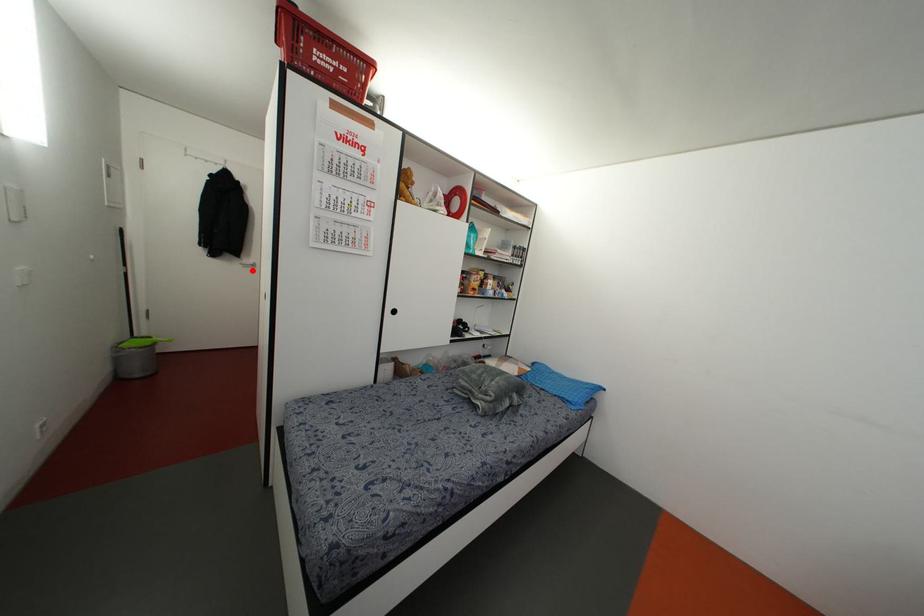
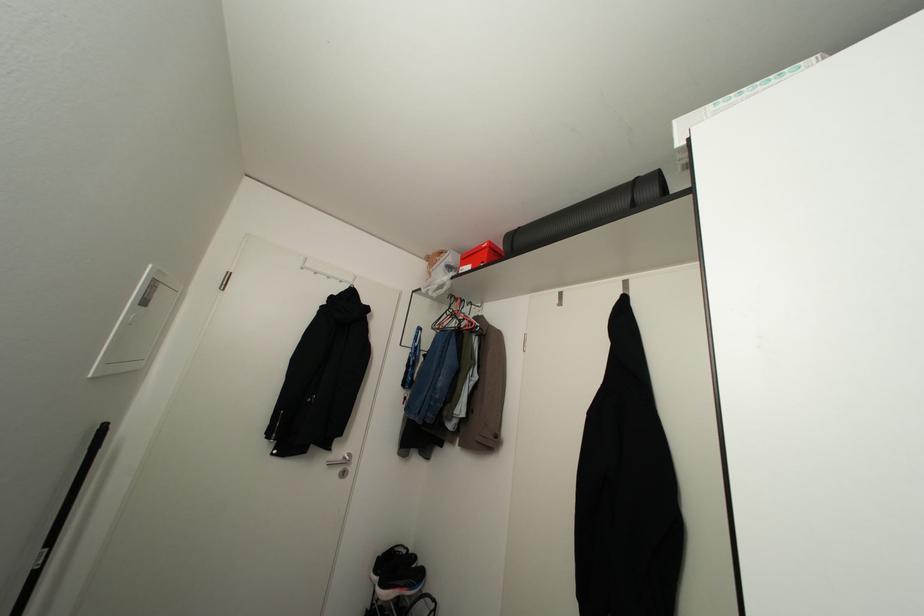
The point at the highlighted location is marked in the first image. Where is the corresponding point in the second image?

(343, 472)